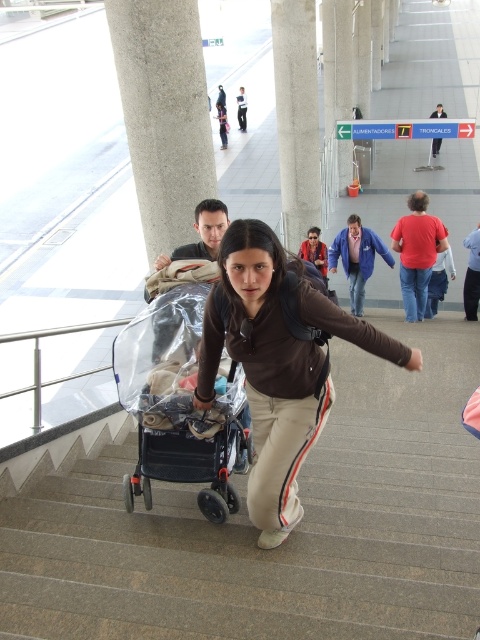
You are a security guard in the transportation hub. You notice a matte black stroller at center and a white fabric shirt at center. Which object is closer to you?

The matte black stroller at center is closer to you than the white fabric shirt at center.

You are a janitor in the transportation hub. You need to clean the area around the transparent plastic baby carriage at center and the white fabric shirt at center. Which object requires a larger cleaning area due to its size?

The transparent plastic baby carriage at center requires a larger cleaning area because it is larger in size than the white fabric shirt at center.